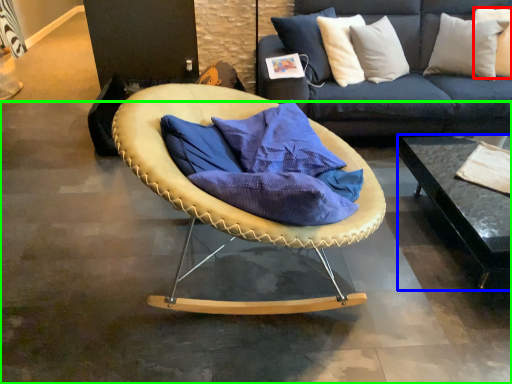
Question: Which is farther away from pillow (highlighted by a red box)? table (highlighted by a blue box) or concrete (highlighted by a green box)?

Choices:
 (A) table
 (B) concrete

Answer: (B)